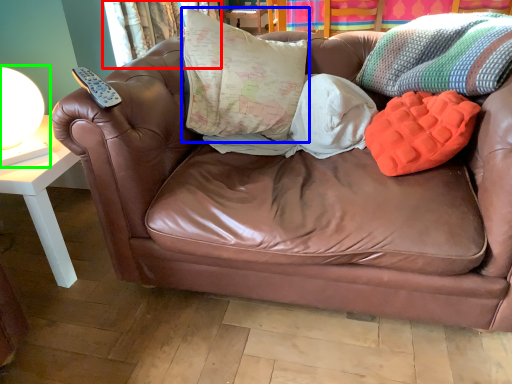
Question: Based on their relative distances, which object is farther from curtain (highlighted by a red box)? Choose from pillow (highlighted by a blue box) and table lamp (highlighted by a green box).

Choices:
 (A) pillow
 (B) table lamp

Answer: (B)